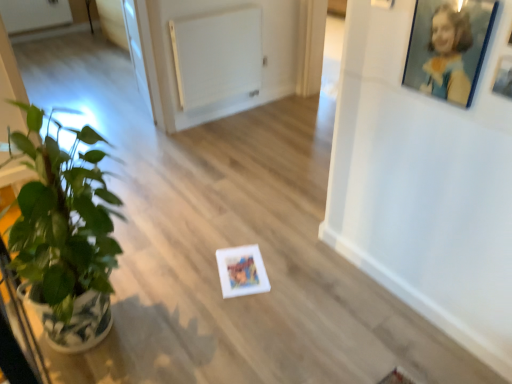
Where is `vacant area on top of white matte radiator at upper center (from a real-world perspective)`? Image resolution: width=512 pixels, height=384 pixels. vacant area on top of white matte radiator at upper center (from a real-world perspective) is located at coordinates (214, 13).